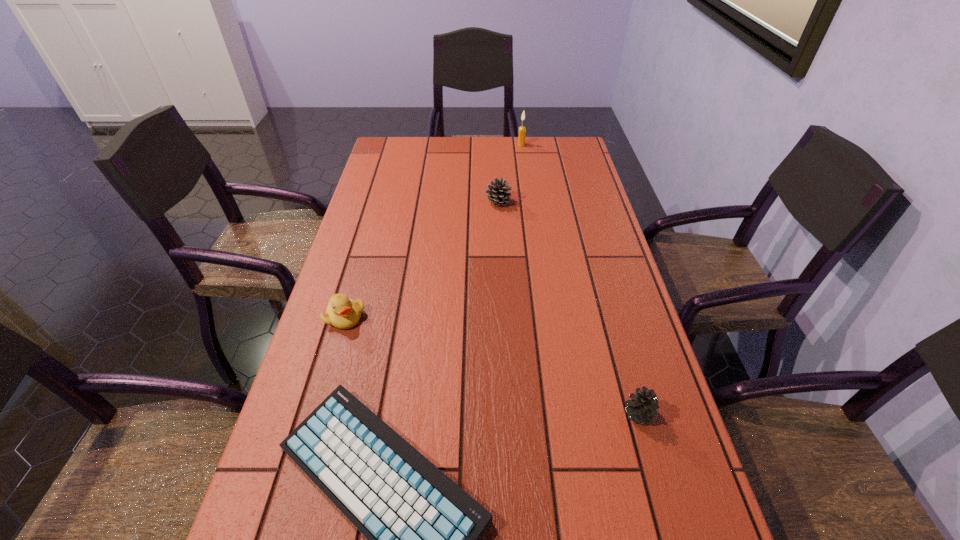
Locate an element on the screen. Image resolution: width=960 pixels, height=540 pixels. vacant space in between the third nearest object and the rightmost object is located at coordinates click(x=492, y=365).

Find the location of `empty space between the third nearest object and the nearer pinecone`. empty space between the third nearest object and the nearer pinecone is located at coordinates (492, 365).

You are a GUI agent. You are given a task and a screenshot of the screen. Output one action in this format:
    pyautogui.click(x=<x>, y=<y>)
    Task: Click on the vacant space that is in between the farther pinecone and the third farthest object
    
    Given the screenshot: What is the action you would take?
    pyautogui.click(x=421, y=259)

Where is `object that is the second closest to the candle`? The image size is (960, 540). object that is the second closest to the candle is located at coordinates (342, 312).

Identify the location of the closest object to the computer keyboard. The image size is (960, 540). (342, 312).